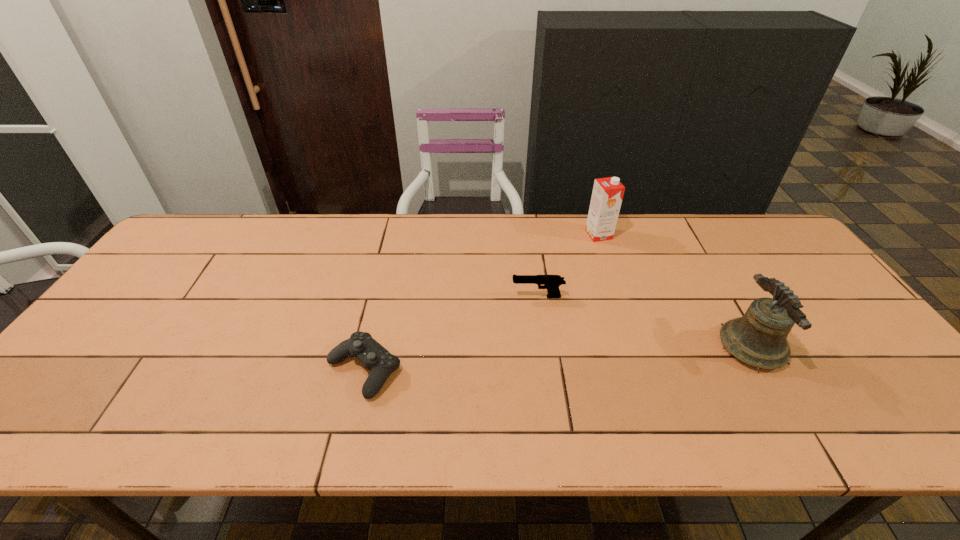
I want to click on vacant area located on the front-facing side of the third tallest object, so click(x=458, y=296).

The image size is (960, 540). I want to click on free spot located on the front-facing side of the third tallest object, so (390, 296).

Find the location of a particular element. free space located 0.320m on the back of the control is located at coordinates (390, 260).

Find the location of `object present at the far edge`. object present at the far edge is located at coordinates (607, 195).

Where is `blank space at the far edge`? Image resolution: width=960 pixels, height=540 pixels. blank space at the far edge is located at coordinates (562, 230).

The height and width of the screenshot is (540, 960). I want to click on free space at the near edge of the desktop, so click(825, 406).

This screenshot has height=540, width=960. In the image, there is a desktop. Identify the location of vacant space at the left edge. (140, 318).

The image size is (960, 540). I want to click on free region at the right edge of the desktop, so click(874, 387).

In order to click on free space between the carton and the pistol in this screenshot , I will do `click(568, 266)`.

Locate an element on the screen. The image size is (960, 540). blank region between the shortest object and the carton is located at coordinates (481, 302).